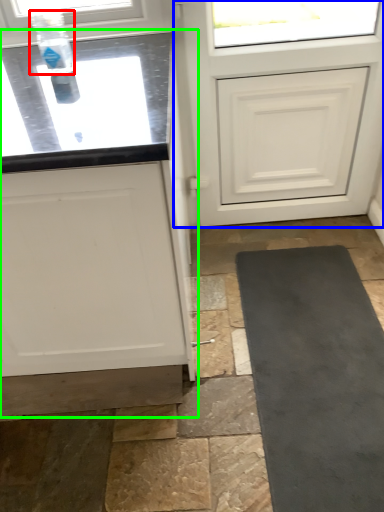
Question: Which is farther away from bottle (highlighted by a red box)? door (highlighted by a blue box) or cabinetry (highlighted by a green box)?

Choices:
 (A) door
 (B) cabinetry

Answer: (A)